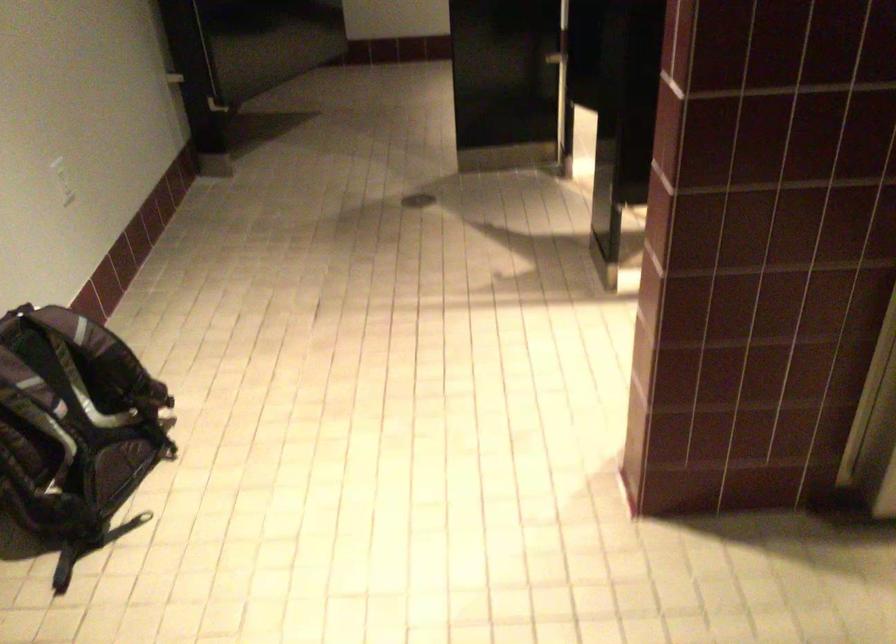
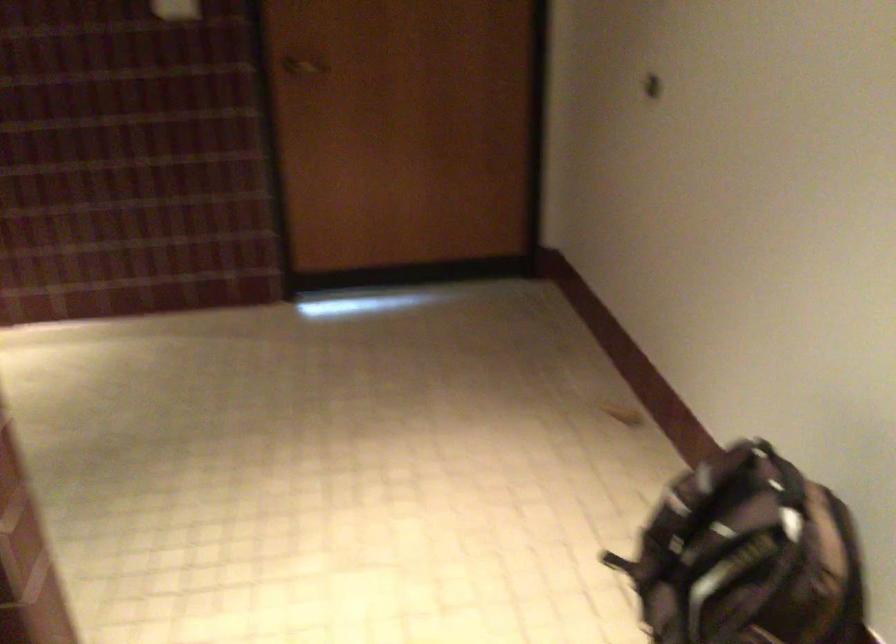
Locate, in the second image, the point that corresponds to [73,359] in the first image.

(748, 556)